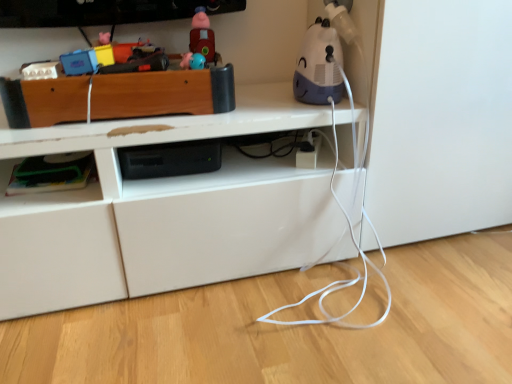
This screenshot has height=384, width=512. What do you see at coordinates (162, 93) in the screenshot?
I see `wooden toy box at upper left, which is the 2th shelf in bottom-to-top order` at bounding box center [162, 93].

Find the location of a particular element. The height and width of the screenshot is (384, 512). white plastic humidifier at upper right, which is the first toy from right to left is located at coordinates (319, 66).

From a real-world perspective, is white plastic humidifier at upper right, which is the first toy from right to left, over rubberized red train at upper center, which ranks as the first toy in left-to-right order?

No, from a real-world perspective, white plastic humidifier at upper right, which is the first toy from right to left, is not above rubberized red train at upper center, which ranks as the first toy in left-to-right order.

From the image's perspective, which one is positioned lower, white plastic humidifier at upper right, which ranks as the 2th toy in left-to-right order, or rubberized red train at upper center, which ranks as the first toy in left-to-right order?

Answer: white plastic humidifier at upper right, which ranks as the 2th toy in left-to-right order, is shown below in the image.

Between white plastic humidifier at upper right, which ranks as the 2th toy in left-to-right order, and rubberized red train at upper center, marked as the second toy in a right-to-left arrangement, which one has larger width?

white plastic humidifier at upper right, which ranks as the 2th toy in left-to-right order, is wider.

The width and height of the screenshot is (512, 384). What are the coordinates of `toy below the rubberized red train at upper center, marked as the second toy in a right-to-left arrangement (from the image's perspective)` in the screenshot? It's located at (319, 66).

Can you tell me how much green plastic container at lower left, marked as the second shelf in a top-to-bottom arrangement, and wooden toy box at upper left, which is the 2th shelf in bottom-to-top order, differ in facing direction?

They differ by 91.1 degrees in their facing directions.

You are a GUI agent. You are given a task and a screenshot of the screen. Output one action in this format:
    pyautogui.click(x=<x>, y=<y>)
    Task: Click on the shelf above the green plastic container at lower left, which is the 1th shelf from bottom to top (from the image's perspective)
    
    Given the screenshot: What is the action you would take?
    pyautogui.click(x=162, y=93)

Is point (52, 207) behind point (113, 102)?

No, it is not.

In the scene shown: Which of these two, white plastic humidifier at upper right, which is the first toy from right to left, or wooden toy box at upper left, which is the 2th shelf in bottom-to-top order, is bigger?

wooden toy box at upper left, which is the 2th shelf in bottom-to-top order, is bigger.

There is a white plastic humidifier at upper right, which is the first toy from right to left. Find the location of `the 1st shelf below it (from a real-world perspective)`. the 1st shelf below it (from a real-world perspective) is located at coordinates (162, 93).

Between white plastic humidifier at upper right, which ranks as the 2th toy in left-to-right order, and wooden toy box at upper left, which is the 2th shelf in bottom-to-top order, which one has more height?

Standing taller between the two is white plastic humidifier at upper right, which ranks as the 2th toy in left-to-right order.

Is white plastic humidifier at upper right, which is the first toy from right to left, aimed at wooden toy box at upper left, the first shelf in the top-to-bottom sequence?

No, white plastic humidifier at upper right, which is the first toy from right to left, is not turned towards wooden toy box at upper left, the first shelf in the top-to-bottom sequence.

The width and height of the screenshot is (512, 384). In order to click on toy behind the green plastic container at lower left, marked as the second shelf in a top-to-bottom arrangement in this screenshot , I will do `click(202, 36)`.

Is point (194, 51) closer to camera compared to point (56, 203)?

That is False.

Can you confirm if rubberized red train at upper center, which ranks as the first toy in left-to-right order, is wider than green plastic container at lower left, which is the 1th shelf from bottom to top?

No.

Can you confirm if rubberized red train at upper center, marked as the second toy in a right-to-left arrangement, is shorter than green plastic container at lower left, which is the 1th shelf from bottom to top?

In fact, rubberized red train at upper center, marked as the second toy in a right-to-left arrangement, may be taller than green plastic container at lower left, which is the 1th shelf from bottom to top.

Which is more to the right, rubberized red train at upper center, which ranks as the first toy in left-to-right order, or wooden toy box at upper left, which is the 2th shelf in bottom-to-top order?

From the viewer's perspective, rubberized red train at upper center, which ranks as the first toy in left-to-right order, appears more on the right side.

Which is closer to the camera, (198,14) or (110,84)?

Point (198,14).

From the picture: Is wooden toy box at upper left, which is the 2th shelf in bottom-to-top order, a part of rubberized red train at upper center, which ranks as the first toy in left-to-right order?

No, rubberized red train at upper center, which ranks as the first toy in left-to-right order, does not contain wooden toy box at upper left, which is the 2th shelf in bottom-to-top order.

Can you confirm if rubberized red train at upper center, marked as the second toy in a right-to-left arrangement, is taller than wooden toy box at upper left, which is the 2th shelf in bottom-to-top order?

Correct, rubberized red train at upper center, marked as the second toy in a right-to-left arrangement, is much taller as wooden toy box at upper left, which is the 2th shelf in bottom-to-top order.

Between green plastic container at lower left, which is the 1th shelf from bottom to top, and white plastic humidifier at upper right, which is the first toy from right to left, which one has larger width?

With larger width is green plastic container at lower left, which is the 1th shelf from bottom to top.

Is green plastic container at lower left, which is the 1th shelf from bottom to top, beside white plastic humidifier at upper right, which ranks as the 2th toy in left-to-right order?

No, green plastic container at lower left, which is the 1th shelf from bottom to top, is not next to white plastic humidifier at upper right, which ranks as the 2th toy in left-to-right order.

Considering the positions of point (81, 196) and point (300, 54), is point (81, 196) closer or farther from the camera than point (300, 54)?

Point (81, 196) appears to be closer to the viewer than point (300, 54).

From the image's perspective, would you say green plastic container at lower left, which is the 1th shelf from bottom to top, is positioned over white plastic humidifier at upper right, which ranks as the 2th toy in left-to-right order?

No, from the image's perspective, green plastic container at lower left, which is the 1th shelf from bottom to top, is not over white plastic humidifier at upper right, which ranks as the 2th toy in left-to-right order.

From the image's perspective, between wooden toy box at upper left, which is the 2th shelf in bottom-to-top order, and green plastic container at lower left, marked as the second shelf in a top-to-bottom arrangement, which one is located above?

wooden toy box at upper left, which is the 2th shelf in bottom-to-top order.

Does wooden toy box at upper left, the first shelf in the top-to-bottom sequence, have a smaller size compared to green plastic container at lower left, marked as the second shelf in a top-to-bottom arrangement?

Actually, wooden toy box at upper left, the first shelf in the top-to-bottom sequence, might be larger than green plastic container at lower left, marked as the second shelf in a top-to-bottom arrangement.

How many degrees apart are the facing directions of wooden toy box at upper left, which is the 2th shelf in bottom-to-top order, and green plastic container at lower left, marked as the second shelf in a top-to-bottom arrangement?

They differ by 91.1 degrees in their facing directions.

In the scene shown: From a real-world perspective, is wooden toy box at upper left, which is the 2th shelf in bottom-to-top order, physically located above or below green plastic container at lower left, marked as the second shelf in a top-to-bottom arrangement?

wooden toy box at upper left, which is the 2th shelf in bottom-to-top order, is situated higher than green plastic container at lower left, marked as the second shelf in a top-to-bottom arrangement, in the real world.

Identify the location of toy on the left of white plastic humidifier at upper right, which ranks as the 2th toy in left-to-right order. The image size is (512, 384). (202, 36).

This screenshot has width=512, height=384. What are the coordinates of `shelf located on the right of green plastic container at lower left, marked as the second shelf in a top-to-bottom arrangement` in the screenshot? It's located at (162, 93).

When comparing their distances from rubberized red train at upper center, which ranks as the first toy in left-to-right order, does green plastic container at lower left, marked as the second shelf in a top-to-bottom arrangement, or wooden toy box at upper left, the first shelf in the top-to-bottom sequence, seem closer?

Based on the image, wooden toy box at upper left, the first shelf in the top-to-bottom sequence, appears to be nearer to rubberized red train at upper center, which ranks as the first toy in left-to-right order.

Looking at the image, which one is located further to white plastic humidifier at upper right, which is the first toy from right to left, green plastic container at lower left, marked as the second shelf in a top-to-bottom arrangement, or wooden toy box at upper left, the first shelf in the top-to-bottom sequence?

green plastic container at lower left, marked as the second shelf in a top-to-bottom arrangement, is further to white plastic humidifier at upper right, which is the first toy from right to left.

In the scene shown: Estimate the real-world distances between objects in this image. Which object is further from wooden toy box at upper left, the first shelf in the top-to-bottom sequence, rubberized red train at upper center, marked as the second toy in a right-to-left arrangement, or green plastic container at lower left, marked as the second shelf in a top-to-bottom arrangement?

rubberized red train at upper center, marked as the second toy in a right-to-left arrangement, is further to wooden toy box at upper left, the first shelf in the top-to-bottom sequence.

Based on their spatial positions, is white plastic humidifier at upper right, which ranks as the 2th toy in left-to-right order, or wooden toy box at upper left, the first shelf in the top-to-bottom sequence, closer to rubberized red train at upper center, which ranks as the first toy in left-to-right order?

The object closer to rubberized red train at upper center, which ranks as the first toy in left-to-right order, is wooden toy box at upper left, the first shelf in the top-to-bottom sequence.

Which object lies nearer to the anchor point green plastic container at lower left, marked as the second shelf in a top-to-bottom arrangement, white plastic humidifier at upper right, which is the first toy from right to left, or rubberized red train at upper center, which ranks as the first toy in left-to-right order?

Based on the image, rubberized red train at upper center, which ranks as the first toy in left-to-right order, appears to be nearer to green plastic container at lower left, marked as the second shelf in a top-to-bottom arrangement.

Based on their spatial positions, is wooden toy box at upper left, the first shelf in the top-to-bottom sequence, or rubberized red train at upper center, marked as the second toy in a right-to-left arrangement, closer to white plastic humidifier at upper right, which ranks as the 2th toy in left-to-right order?

Based on the image, rubberized red train at upper center, marked as the second toy in a right-to-left arrangement, appears to be nearer to white plastic humidifier at upper right, which ranks as the 2th toy in left-to-right order.

Estimate the real-world distances between objects in this image. Which object is further from green plastic container at lower left, marked as the second shelf in a top-to-bottom arrangement, rubberized red train at upper center, marked as the second toy in a right-to-left arrangement, or wooden toy box at upper left, which is the 2th shelf in bottom-to-top order?

rubberized red train at upper center, marked as the second toy in a right-to-left arrangement, lies further to green plastic container at lower left, marked as the second shelf in a top-to-bottom arrangement, than the other object.

From the image, which object appears to be nearer to green plastic container at lower left, which is the 1th shelf from bottom to top, white plastic humidifier at upper right, which ranks as the 2th toy in left-to-right order, or wooden toy box at upper left, which is the 2th shelf in bottom-to-top order?

wooden toy box at upper left, which is the 2th shelf in bottom-to-top order.

Locate an element on the screen. This screenshot has width=512, height=384. shelf located between green plastic container at lower left, marked as the second shelf in a top-to-bottom arrangement, and rubberized red train at upper center, which ranks as the first toy in left-to-right order, in the left-right direction is located at coordinates pos(162,93).

Locate an element on the screen. The height and width of the screenshot is (384, 512). toy situated between wooden toy box at upper left, which is the 2th shelf in bottom-to-top order, and white plastic humidifier at upper right, which is the first toy from right to left, from left to right is located at coordinates (202, 36).

Locate an element on the screen. toy between green plastic container at lower left, which is the 1th shelf from bottom to top, and white plastic humidifier at upper right, which is the first toy from right to left, in the horizontal direction is located at coordinates [x=202, y=36].

Find the location of `shelf between green plastic container at lower left, which is the 1th shelf from bottom to top, and white plastic humidifier at upper right, which is the first toy from right to left, in the horizontal direction`. shelf between green plastic container at lower left, which is the 1th shelf from bottom to top, and white plastic humidifier at upper right, which is the first toy from right to left, in the horizontal direction is located at coordinates (162, 93).